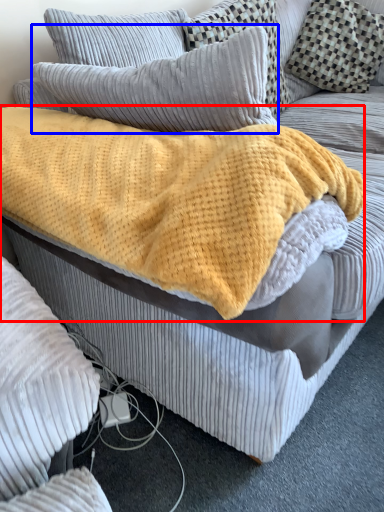
Question: Which point is closer to the camera, blanket (highlighted by a red box) or pillow (highlighted by a blue box)?

Choices:
 (A) blanket
 (B) pillow

Answer: (A)